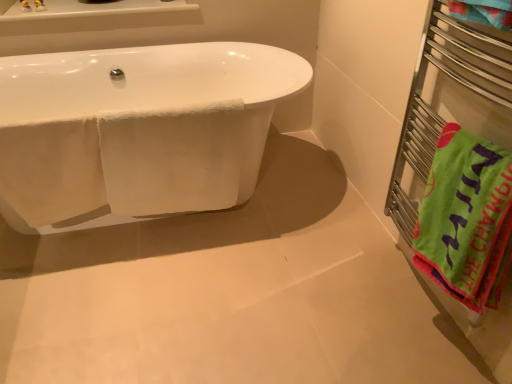
You are a GUI agent. You are given a task and a screenshot of the screen. Output one action in this format:
    pyautogui.click(x=<x>, y=<y>)
    Task: Click on the empty space that is in between white glossy bathtub at left and metal towel rack at right
    Image resolution: width=512 pixels, height=384 pixels.
    Given the screenshot: What is the action you would take?
    pyautogui.click(x=257, y=268)